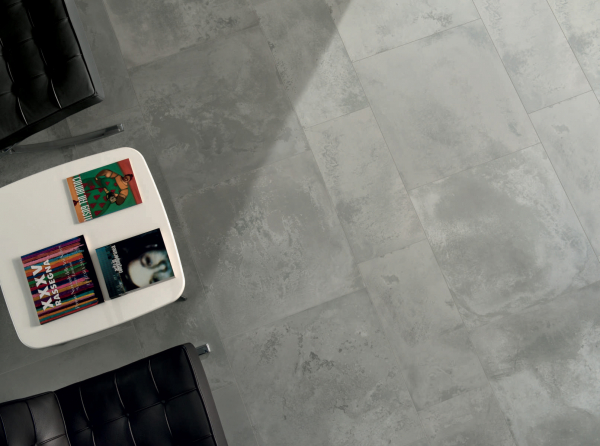
This screenshot has width=600, height=446. What are the coordinates of `floor` in the screenshot? It's located at coord(421,191).